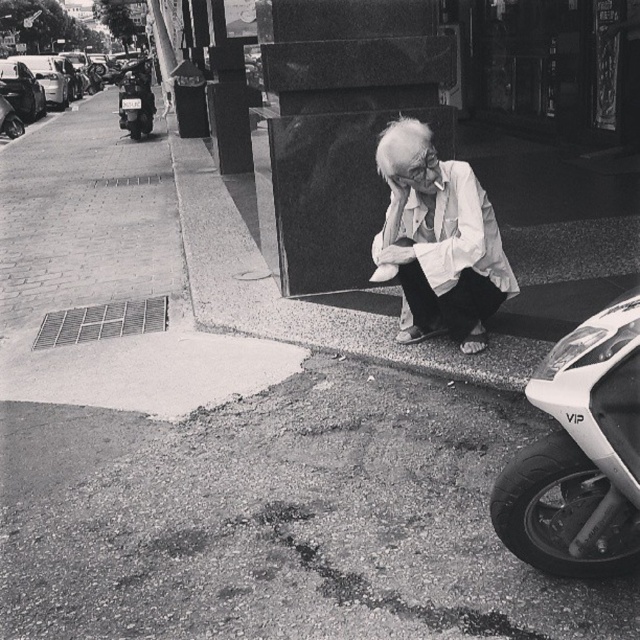
Between white glossy motorcycle at lower right and white wrinkled shirt at lower right, which one is positioned higher?

white wrinkled shirt at lower right is higher up.

Based on the photo, which is below, white glossy motorcycle at lower right or white wrinkled shirt at lower right?

white glossy motorcycle at lower right is below.

Measure the distance between point (x=556, y=356) and camera.

A distance of 2.21 meters exists between point (x=556, y=356) and camera.

Image resolution: width=640 pixels, height=640 pixels. Identify the location of white glossy motorcycle at lower right. [580, 454].

Can you confirm if white glossy motorcycle at lower right is taller than shiny black motorcycle at left?

In fact, white glossy motorcycle at lower right may be shorter than shiny black motorcycle at left.

From the picture: Which of these two, white glossy motorcycle at lower right or shiny black motorcycle at left, stands taller?

shiny black motorcycle at left is taller.

This screenshot has width=640, height=640. What do you see at coordinates (580, 454) in the screenshot?
I see `white glossy motorcycle at lower right` at bounding box center [580, 454].

What are the coordinates of `white glossy motorcycle at lower right` in the screenshot? It's located at (580, 454).

How far apart are white wrinkled shirt at lower right and shiny black motorcycle at left?

They are 44.76 feet apart.

Does white wrinkled shirt at lower right come behind shiny black motorcycle at left?

No.

Locate an element on the screen. Image resolution: width=640 pixels, height=640 pixels. white wrinkled shirt at lower right is located at coordinates (438, 240).

I want to click on white wrinkled shirt at lower right, so click(438, 240).